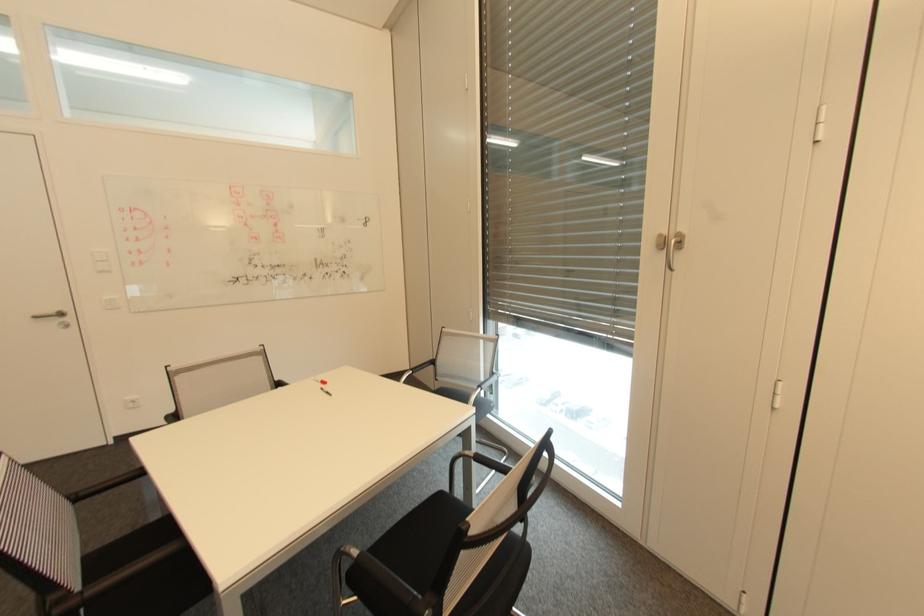
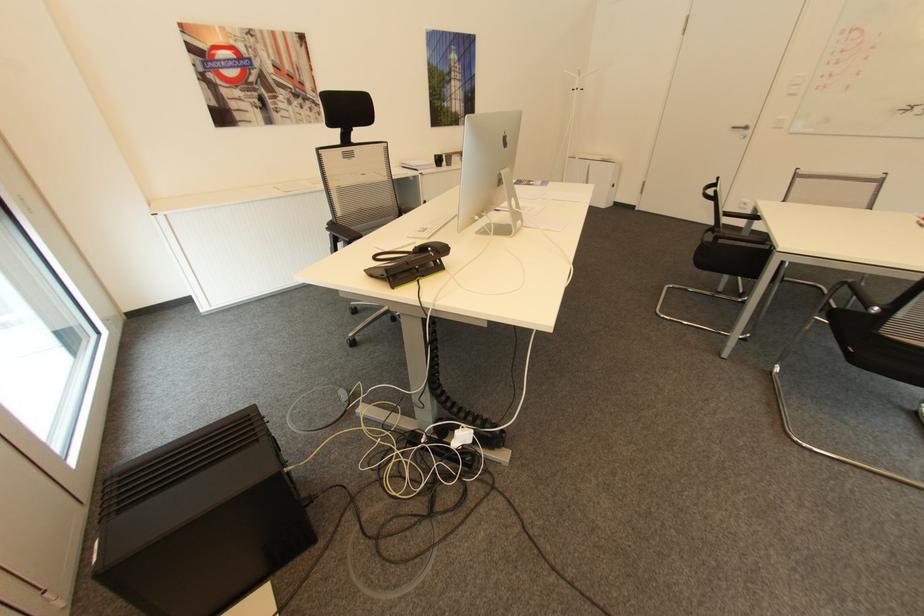
Where in the second image is the point corresponding to (42,317) from the first image?

(736, 128)